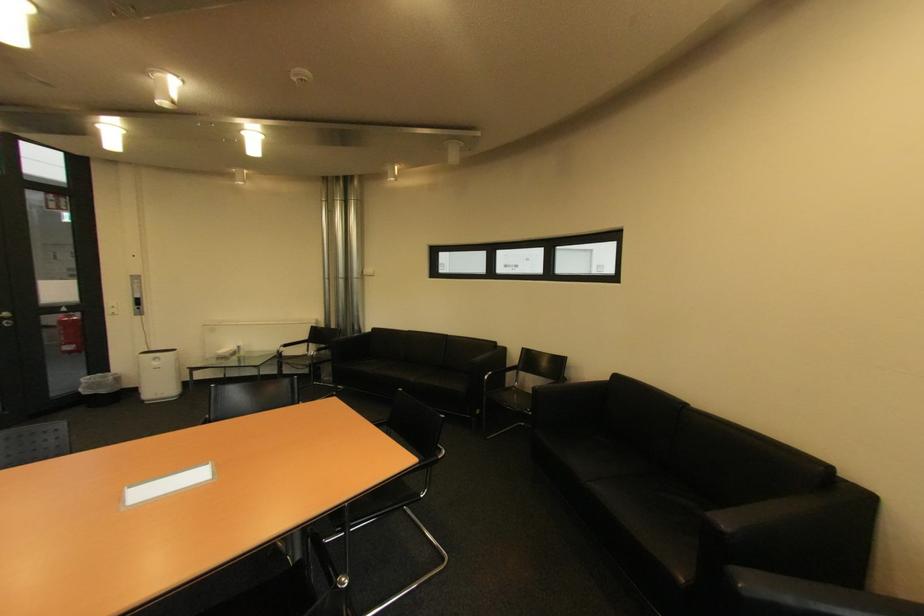
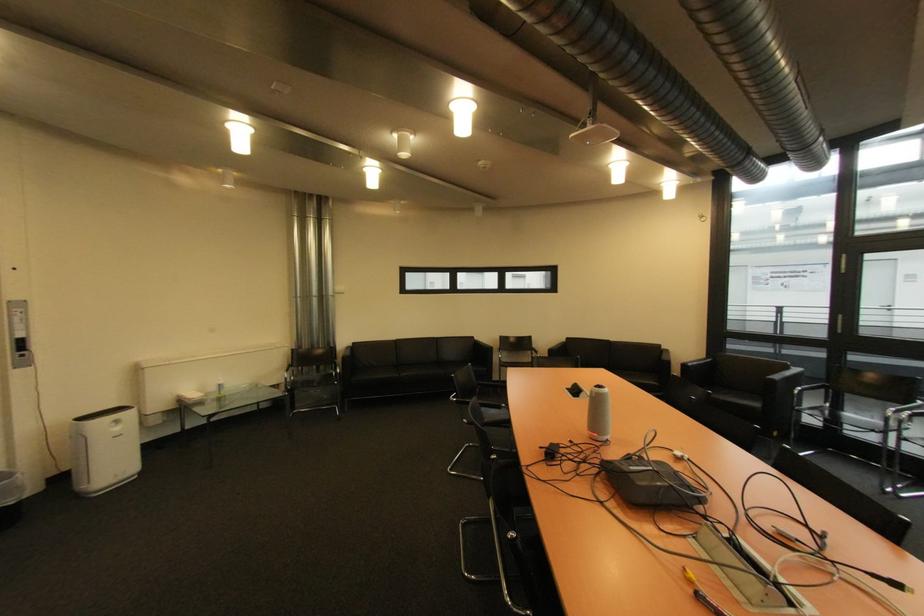
The point at (164, 363) is marked in the first image. Where is the corresponding point in the second image?

(124, 430)